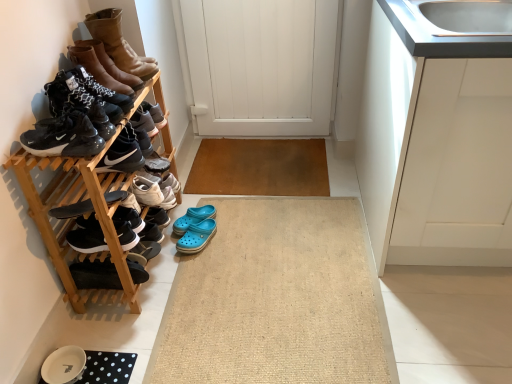
Where is `vacant area located to the right-hand side of blue rubber clogs at center, which is the second footwear in bottom-to-top order`? vacant area located to the right-hand side of blue rubber clogs at center, which is the second footwear in bottom-to-top order is located at coordinates (240, 231).